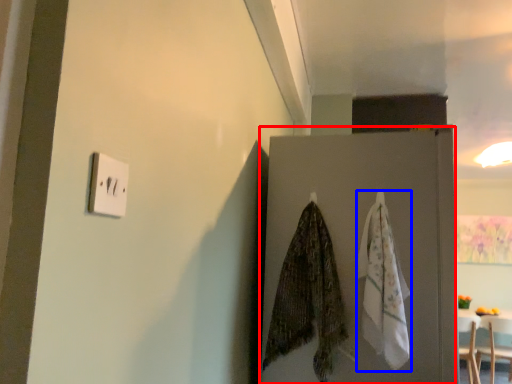
Question: Among these objects, which one is nearest to the camera, door (highlighted by a red box) or blanket (highlighted by a blue box)?

Choices:
 (A) door
 (B) blanket

Answer: (B)